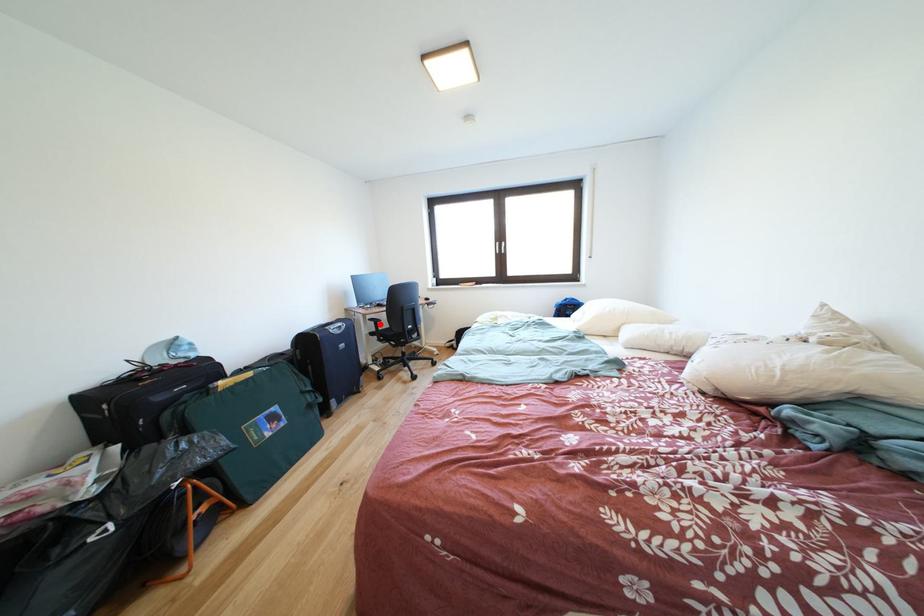
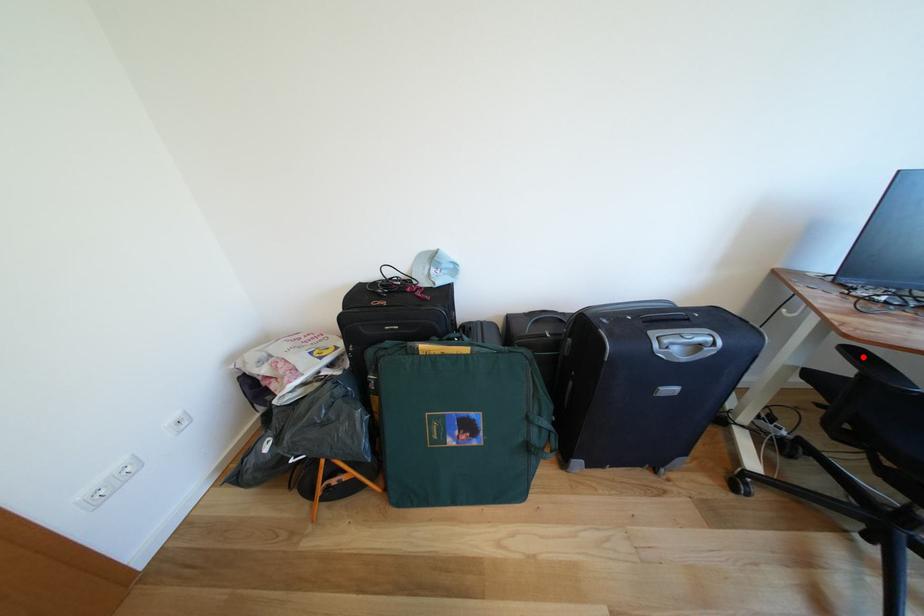
I am providing you with two images of the same scene from different viewpoints. A red point is marked on the first image and another point is marked on the second image. Are the points marked in image1 and image2 representing the same 3D position?

Yes